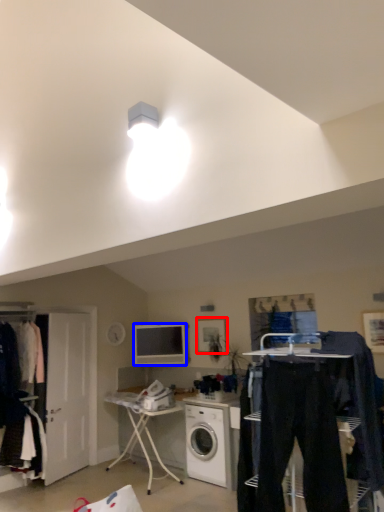
Question: Which object is further to the camera taking this photo, picture frame (highlighted by a red box) or television (highlighted by a blue box)?

Choices:
 (A) picture frame
 (B) television

Answer: (B)